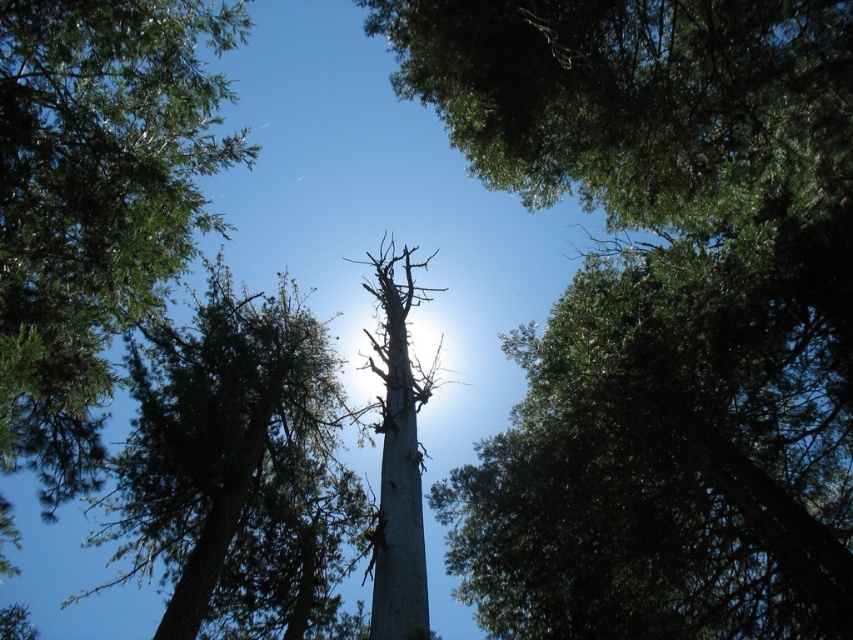
You are a park ranger measuring the distance between two trees in the forest. You see the smooth gray trunk at center and the gray bark tree at center. Which one is farther away from you?

The smooth gray trunk at center is 16.51 feet away from the gray bark tree at center, so whichever one is closer to you, the other would be 16.51 feet further. But since both are at the center, their exact distance from you isn

You are a bird trying to fly between the green textured tree at center and the gray bark tree at center. Can you fit through the space between them?

The green textured tree at center is 11.07 feet from the gray bark tree at center, so yes, the bird can fit through the space between them since the distance is sufficient for flight.

You are a bird trying to land on a tree in the forest. You notice the green textured tree at center and the gray bark tree at center. Which tree has a wider trunk for you to perch on?

The green textured tree at center has a wider trunk than the gray bark tree at center, so it is better for perching.